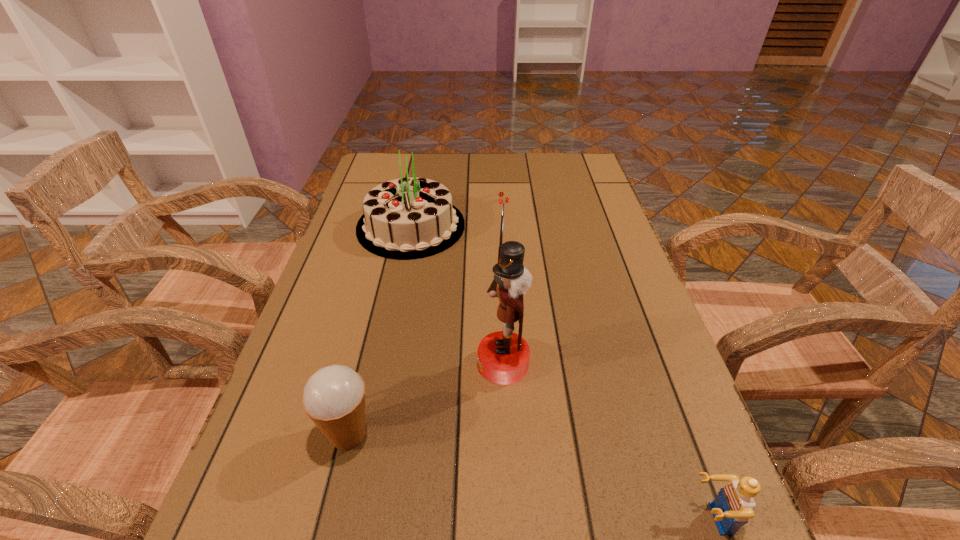
At what (x,y) coordinates should I click in order to perform the action: click on blank space located on the right of the third tallest object. Please return your answer as a coordinate pair (x, y). Looking at the image, I should click on (587, 434).

The height and width of the screenshot is (540, 960). In order to click on birthday cake that is at the left edge in this screenshot , I will do `click(407, 218)`.

The image size is (960, 540). Find the location of `icecream at the left edge`. icecream at the left edge is located at coordinates (334, 397).

Locate an element on the screen. The image size is (960, 540). free region at the far edge of the desktop is located at coordinates click(486, 160).

In the image, there is a desktop. Where is `vacant region at the left edge`? The image size is (960, 540). vacant region at the left edge is located at coordinates (367, 362).

The image size is (960, 540). In order to click on free space at the right edge of the desktop in this screenshot , I will do `click(615, 427)`.

Find the location of a particular element. The image size is (960, 540). vacant space at the far left corner of the desktop is located at coordinates (404, 174).

The width and height of the screenshot is (960, 540). In order to click on vacant space at the far right corner in this screenshot , I will do `click(558, 180)`.

Find the location of a particular element. vacant space that's between the third object from left to right and the third tallest object is located at coordinates (425, 399).

I want to click on free spot between the farthest object and the tallest object, so click(x=457, y=295).